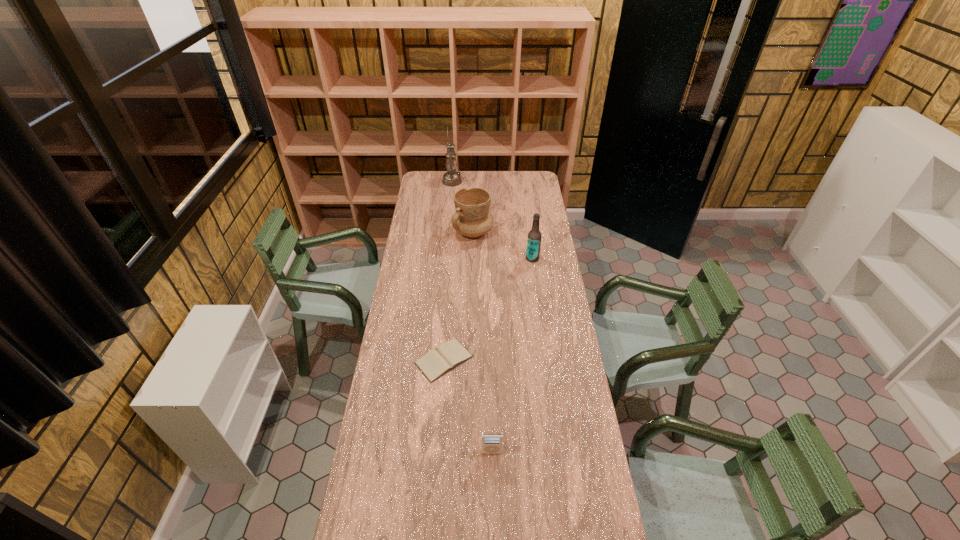
The image size is (960, 540). Find the location of `object located at the far left corner`. object located at the far left corner is located at coordinates (451, 178).

I want to click on free location at the far edge of the desktop, so click(470, 173).

In the image, there is a desktop. Where is `vacant space at the left edge`? vacant space at the left edge is located at coordinates (411, 315).

Locate an element on the screen. The height and width of the screenshot is (540, 960). free spot at the right edge of the desktop is located at coordinates (586, 456).

The width and height of the screenshot is (960, 540). In the image, there is a desktop. In order to click on vacant space at the far right corner in this screenshot , I will do `click(542, 186)`.

The width and height of the screenshot is (960, 540). In order to click on empty location between the shortest object and the tallest object in this screenshot , I will do `click(448, 271)`.

Identify the location of free spot between the second farthest object and the shortest object. (458, 296).

Where is `free space between the rightmost object and the pottery`? free space between the rightmost object and the pottery is located at coordinates (503, 245).

I want to click on free spot between the tallest object and the nearest object, so click(472, 317).

Select which object appears as the fourth closest to the fourth nearest object. Please provide its 2D coordinates. Your answer should be formatted as a tuple, i.e. [(x, y)], where the tuple contains the x and y coordinates of a point satisfying the conditions above.

[(491, 442)]